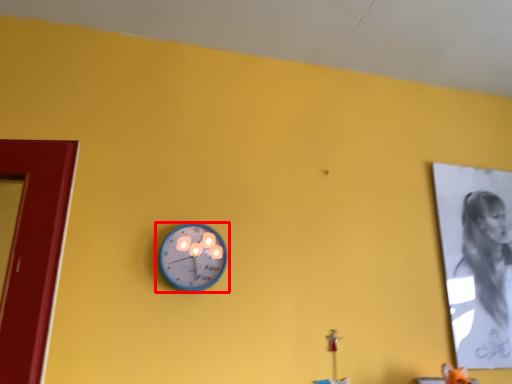
Question: In this image, where is wall clock (annotated by the red box) located relative to person?

Choices:
 (A) left
 (B) right

Answer: (A)